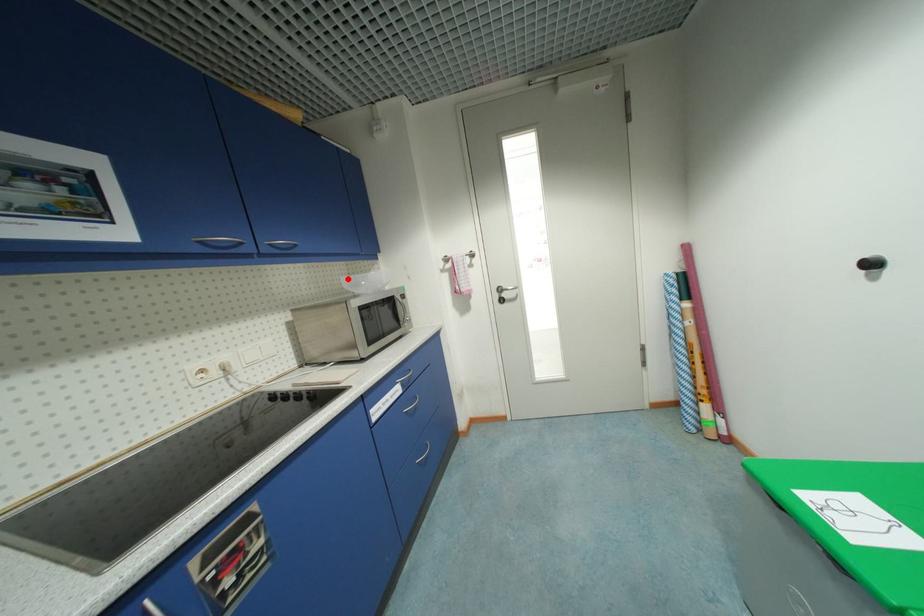
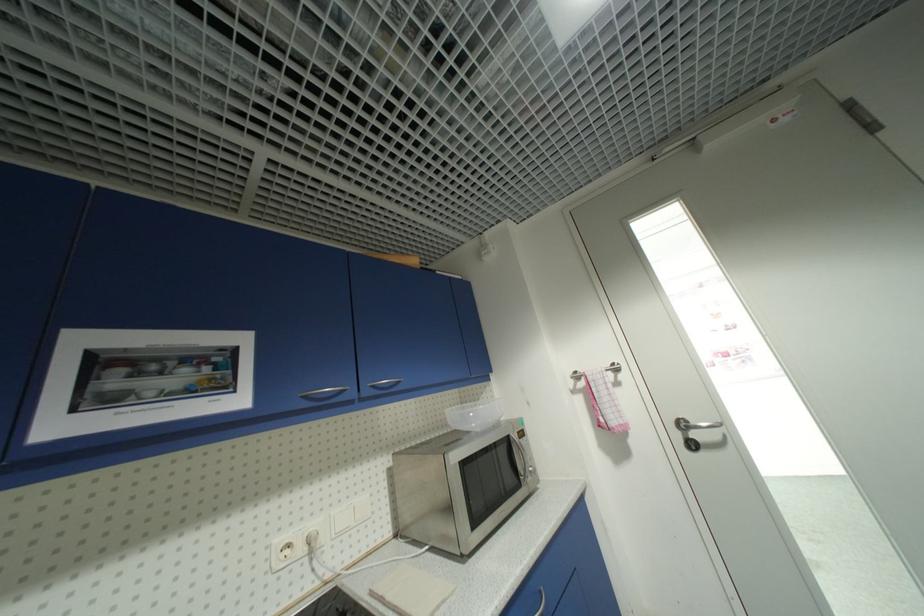
The point at the highlighted location is marked in the first image. Where is the corresponding point in the second image?

(454, 413)